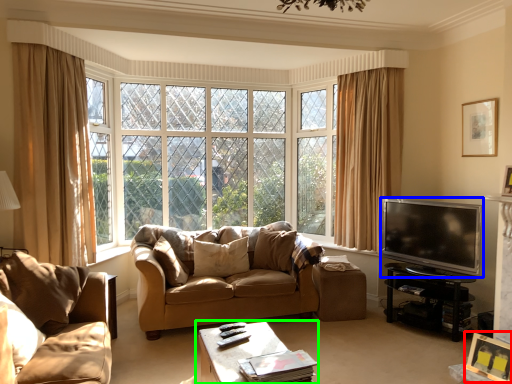
Question: Which object is positioned farthest from picture frame (highlighted by a red box)? Select from television (highlighted by a blue box) and table (highlighted by a green box).

Choices:
 (A) television
 (B) table

Answer: (B)